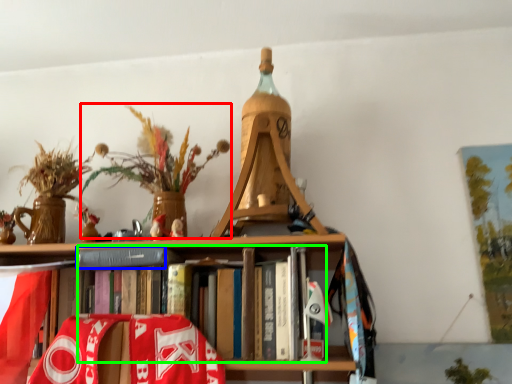
Question: Based on their relative distances, which object is farther from floral arrangement (highlighted by a red box)? Choose from paperback book (highlighted by a blue box) and book (highlighted by a green box).

Choices:
 (A) paperback book
 (B) book

Answer: (B)